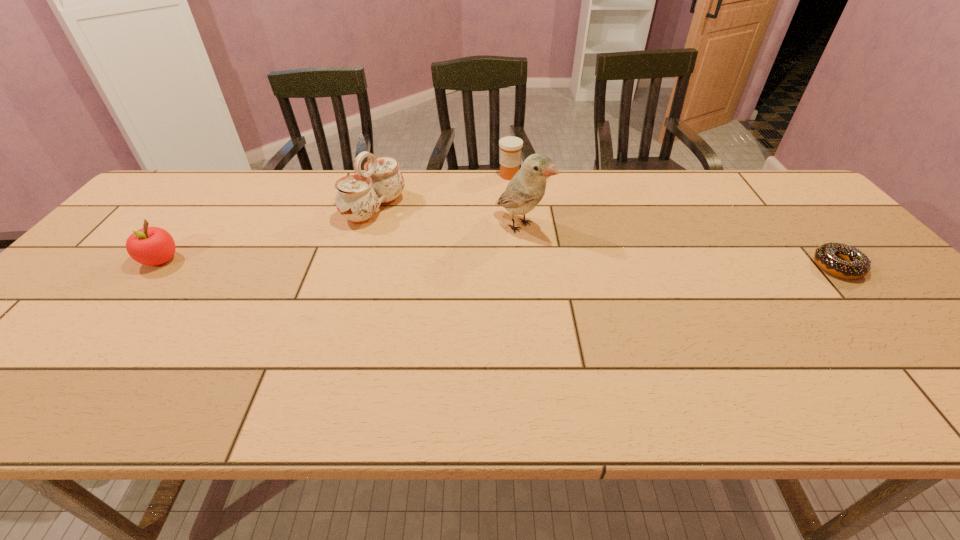
At what (x,y) coordinates should I click in order to perform the action: click on free space that satisfies the following two spatial constraints: 1. on the front side of the farthest object; 2. on the right side of the tallest object. Please return your answer as a coordinate pair (x, y). Looking at the image, I should click on (515, 226).

Image resolution: width=960 pixels, height=540 pixels. Find the location of `free spot that satisfies the following two spatial constraints: 1. on the back side of the leftmost object; 2. on the left side of the medicine`. free spot that satisfies the following two spatial constraints: 1. on the back side of the leftmost object; 2. on the left side of the medicine is located at coordinates (229, 176).